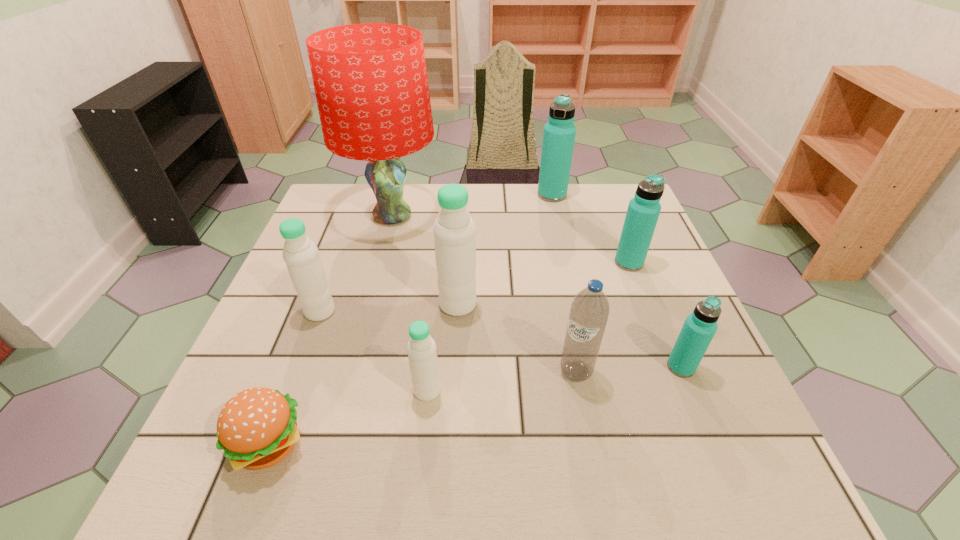
At what (x,y) coordinates should I click in order to perform the action: click on lampshade. Please return your answer as a coordinate pair (x, y). Looking at the image, I should click on (370, 79).

Find the location of a particular element. The height and width of the screenshot is (540, 960). the biggest blue water bottle is located at coordinates (559, 133).

The height and width of the screenshot is (540, 960). Find the location of `the farthest blue water bottle`. the farthest blue water bottle is located at coordinates (559, 133).

Where is `the biggest white water bottle`? This screenshot has height=540, width=960. the biggest white water bottle is located at coordinates (454, 230).

Where is `the seventh nearest object`? The image size is (960, 540). the seventh nearest object is located at coordinates (643, 211).

At what (x,y) coordinates should I click in order to perform the action: click on the sixth nearest water bottle. Please return your answer as a coordinate pair (x, y). Looking at the image, I should click on (643, 211).

Locate an element on the screen. the second biggest white water bottle is located at coordinates pyautogui.click(x=304, y=265).

Locate an element on the screen. The height and width of the screenshot is (540, 960). the leftmost white water bottle is located at coordinates [304, 265].

Where is `the smallest blue water bottle`? This screenshot has width=960, height=540. the smallest blue water bottle is located at coordinates (699, 328).

This screenshot has width=960, height=540. Identify the location of the smallest white water bottle. (421, 349).